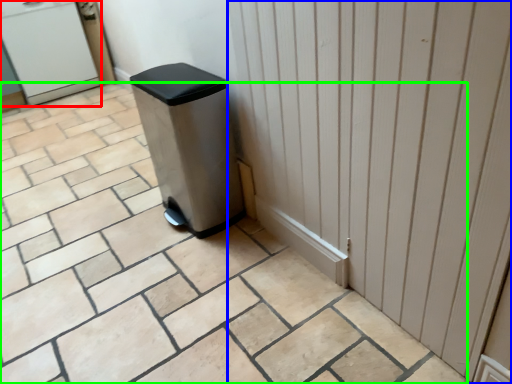
Question: Estimate the real-world distances between objects in this image. Which object is farther from water cooler (highlighted by a red box), door (highlighted by a blue box) or ceramic tile (highlighted by a green box)?

Choices:
 (A) door
 (B) ceramic tile

Answer: (A)